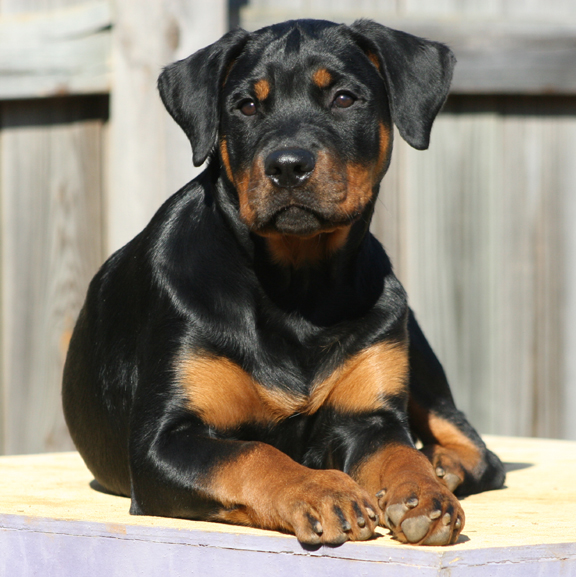
Locate an element on the screen. The height and width of the screenshot is (577, 576). left front leg is located at coordinates (389, 452).